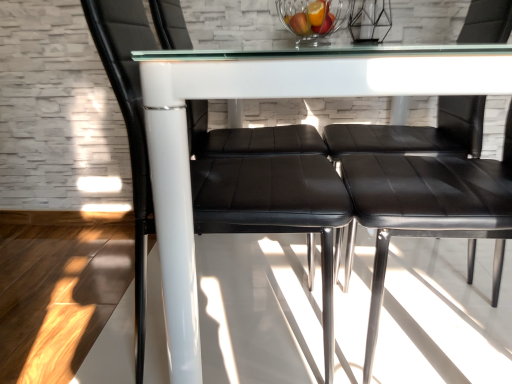
Find the location of a particular element. vacant space to the left of transparent glass table at center is located at coordinates (88, 287).